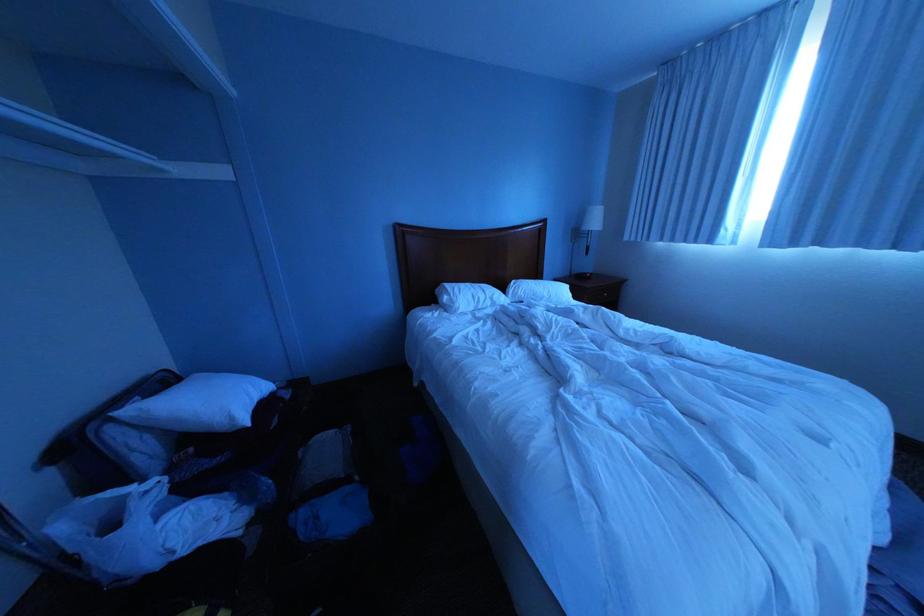
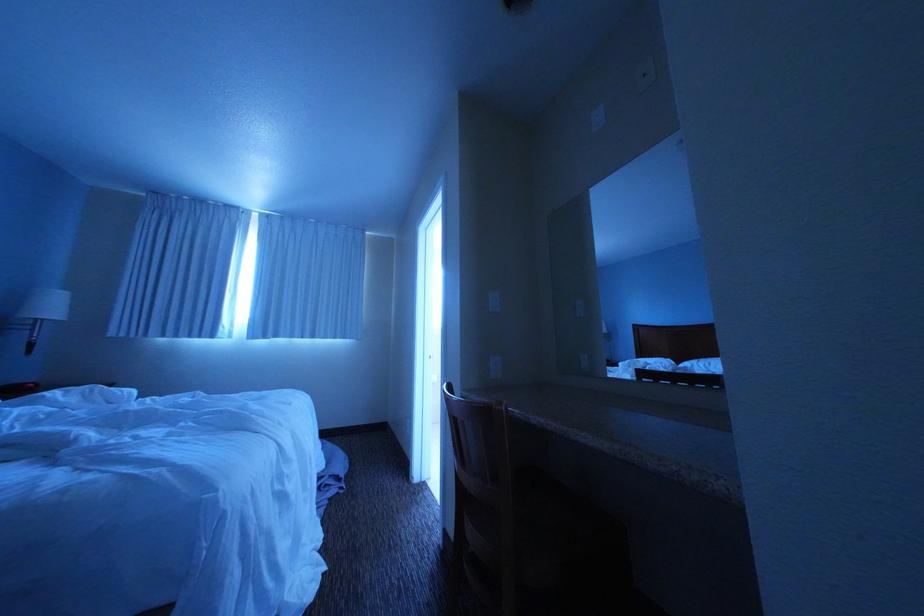
Question: The camera is either moving clockwise (left) or counter-clockwise (right) around the object. The first image is from the beginning of the video and the second image is from the end. Is the camera moving left or right when shooting the video?

Choices:
 (A) Left
 (B) Right

Answer: (A)